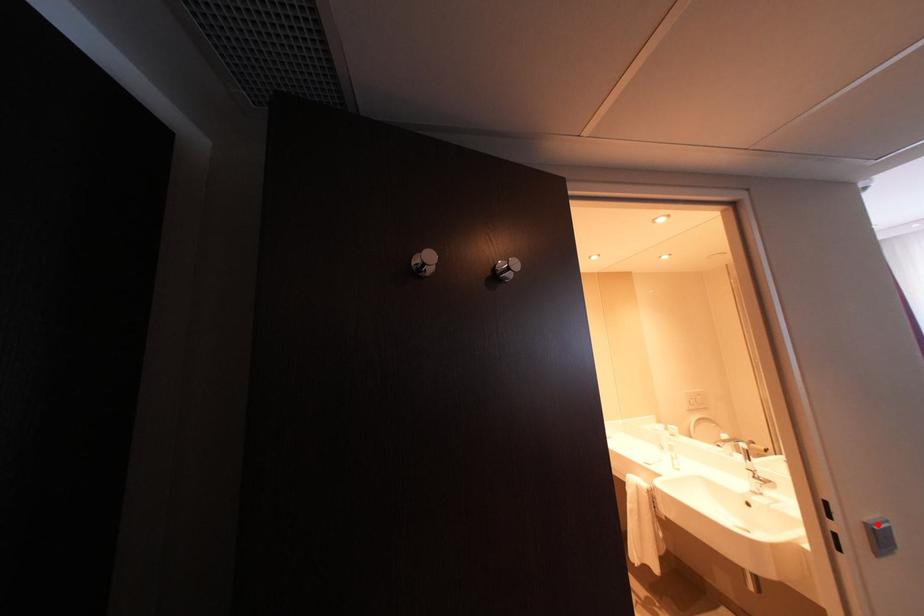
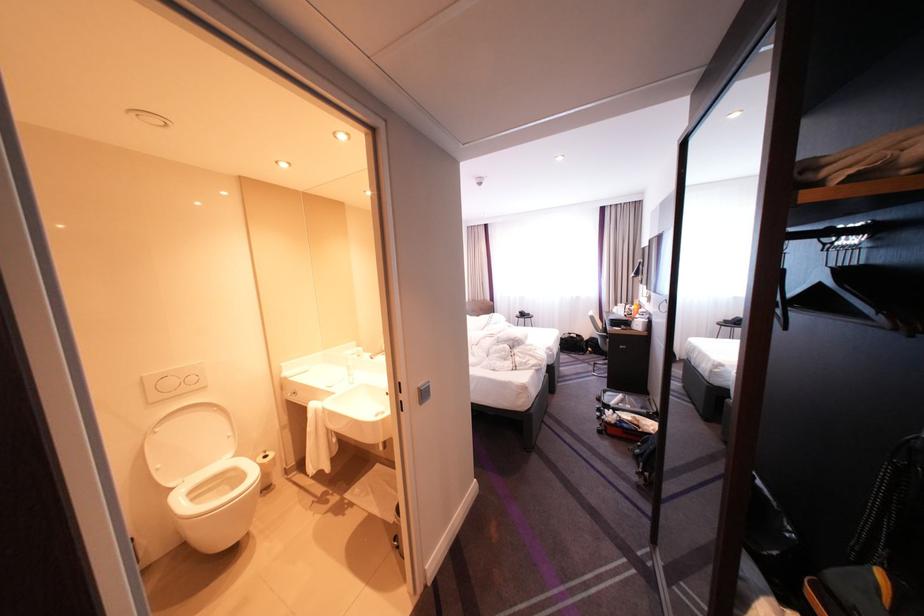
Question: I am providing you with two images of the same scene from different viewpoints. In image1, a red point is highlighted. Considering the same 3D point in image2, which of the following is correct?

Choices:
 (A) It is closer
 (B) It is farther

Answer: (B)